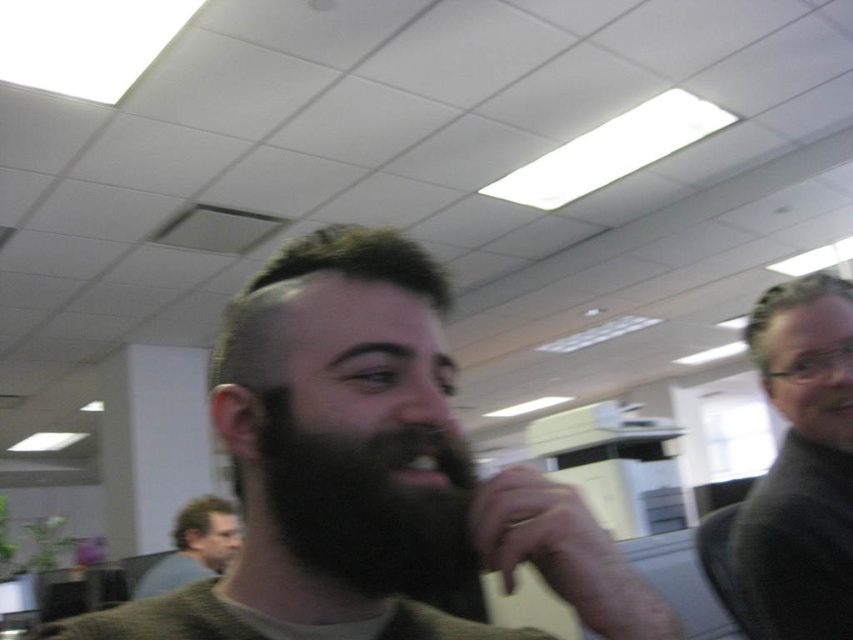
You are standing in an office and see two points marked in the scene. The first point is at coordinates point (486, 522) and the second point is at point (271, 388). Which point is closer to you?

Point (486, 522) is in front of point (271, 388), so it is closer to you.

You are an interior designer assessing the office layout. You notice the dark gray sweater at right and the dark brown hair at lower left. Which object is taller in the image?

The dark brown hair at lower left is taller than the dark gray sweater at right.